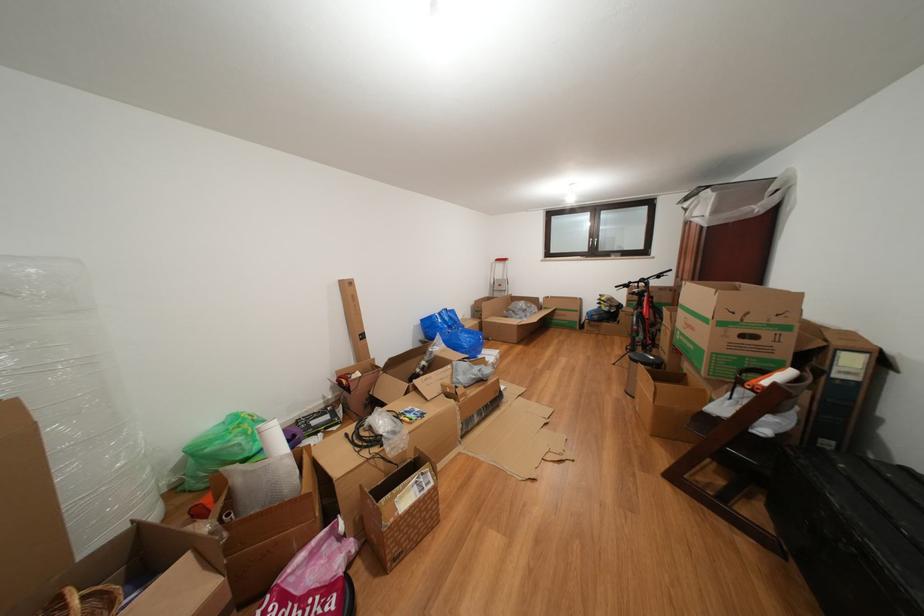
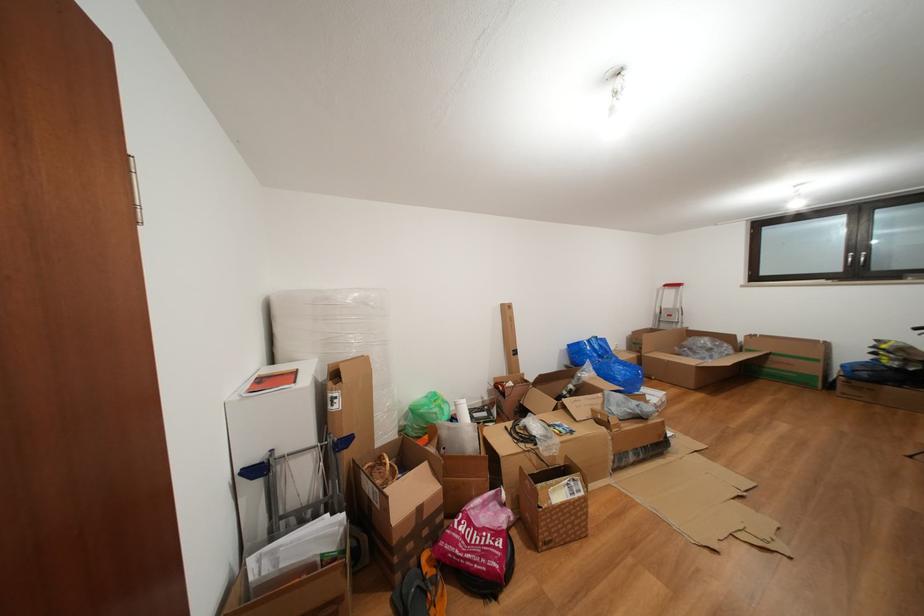
The point at [609,325] is marked in the first image. Where is the corresponding point in the second image?

(886, 387)